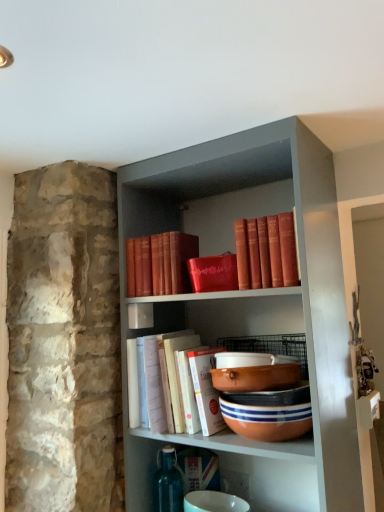
Question: Which direction should I rotate to look at matte orange bowl at center, which is counted as the 3th bowl, starting from the bottom, — up or down?

Choices:
 (A) down
 (B) up

Answer: (A)

Question: From the image's perspective, is red leather book at upper center, arranged as the 1th book when viewed from the top, on matte red book at upper center, the second book from the top?

Choices:
 (A) yes
 (B) no

Answer: (A)

Question: Is matte red book at upper center, positioned as the 2th book in bottom-to-top order, completely or partially inside red leather book at upper center, arranged as the 1th book when viewed from the top?

Choices:
 (A) no
 (B) yes

Answer: (A)

Question: Is red leather book at upper center, marked as the 3th book in a bottom-to-top arrangement, positioned far away from matte red book at upper center, the second book from the top?

Choices:
 (A) no
 (B) yes

Answer: (A)

Question: Is red leather book at upper center, arranged as the 1th book when viewed from the top, at the right side of matte red book at upper center, positioned as the 2th book in bottom-to-top order?

Choices:
 (A) no
 (B) yes

Answer: (B)

Question: Is the depth of red leather book at upper center, arranged as the 1th book when viewed from the top, less than that of matte red book at upper center, the second book from the top?

Choices:
 (A) no
 (B) yes

Answer: (B)

Question: From a real-world perspective, is red leather book at upper center, marked as the 3th book in a bottom-to-top arrangement, on top of matte red book at upper center, positioned as the 2th book in bottom-to-top order?

Choices:
 (A) no
 (B) yes

Answer: (B)

Question: Is white paper book at center, marked as the 1th book in a bottom-to-top arrangement, shorter than terracotta clay bowl at center, the 1th bowl when ordered from bottom to top?

Choices:
 (A) yes
 (B) no

Answer: (B)

Question: Is white paper book at center, the third book positioned from the top, beside terracotta clay bowl at center, the 1th bowl when ordered from bottom to top?

Choices:
 (A) no
 (B) yes

Answer: (A)

Question: Is white paper book at center, the third book positioned from the top, facing away from terracotta clay bowl at center, the 1th bowl when ordered from bottom to top?

Choices:
 (A) yes
 (B) no

Answer: (B)

Question: Is white paper book at center, marked as the 1th book in a bottom-to-top arrangement, closer to the viewer compared to terracotta clay bowl at center, the 1th bowl when ordered from bottom to top?

Choices:
 (A) yes
 (B) no

Answer: (B)

Question: Can you confirm if white paper book at center, the third book positioned from the top, is positioned to the right of terracotta clay bowl at center, the 1th bowl when ordered from bottom to top?

Choices:
 (A) no
 (B) yes

Answer: (A)

Question: Is white paper book at center, marked as the 1th book in a bottom-to-top arrangement, completely or partially outside of terracotta clay bowl at center, the 1th bowl when ordered from bottom to top?

Choices:
 (A) yes
 (B) no

Answer: (A)

Question: Is terracotta clay bowl at center, arranged as the second bowl when ordered from the bottom, shorter than red leather book at upper center, arranged as the 1th book when viewed from the top?

Choices:
 (A) yes
 (B) no

Answer: (A)